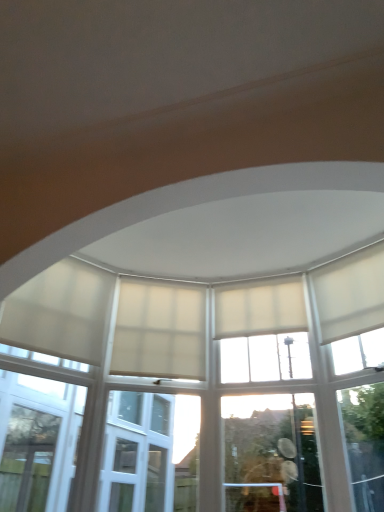
Question: Considering the relative sizes of beige fabric curtain at center, the 3th curtain when ordered from right to left, and white matte curtain at upper right, which appears as the 4th curtain when viewed from the left, in the image provided, is beige fabric curtain at center, the 3th curtain when ordered from right to left, bigger than white matte curtain at upper right, which appears as the 4th curtain when viewed from the left,?

Choices:
 (A) no
 (B) yes

Answer: (A)

Question: Can you confirm if beige fabric curtain at center, the second curtain viewed from the left, is thinner than white matte curtain at upper right, which appears as the 4th curtain when viewed from the left?

Choices:
 (A) no
 (B) yes

Answer: (B)

Question: From the image's perspective, is beige fabric curtain at center, the 3th curtain when ordered from right to left, under white matte curtain at upper right, which appears as the 4th curtain when viewed from the left?

Choices:
 (A) no
 (B) yes

Answer: (B)

Question: Is beige fabric curtain at center, the 3th curtain when ordered from right to left, in front of white matte curtain at upper right, placed as the 1th curtain when sorted from right to left?

Choices:
 (A) yes
 (B) no

Answer: (B)

Question: Is beige fabric curtain at center, the 3th curtain when ordered from right to left, to the left of white matte curtain at upper right, placed as the 1th curtain when sorted from right to left, from the viewer's perspective?

Choices:
 (A) yes
 (B) no

Answer: (A)

Question: From their relative heights in the image, would you say white matte curtain at upper right, placed as the 1th curtain when sorted from right to left, is taller or shorter than beige fabric curtain at center, the second curtain viewed from the left?

Choices:
 (A) tall
 (B) short

Answer: (B)

Question: From the image's perspective, is white matte curtain at upper right, placed as the 1th curtain when sorted from right to left, located above or below beige fabric curtain at center, the second curtain viewed from the left?

Choices:
 (A) below
 (B) above

Answer: (B)

Question: Based on their positions, is white matte curtain at upper right, which appears as the 4th curtain when viewed from the left, located to the left or right of beige fabric curtain at center, the second curtain viewed from the left?

Choices:
 (A) right
 (B) left

Answer: (A)

Question: From a real-world perspective, relative to beige fabric curtain at center, the second curtain viewed from the left, is white matte curtain at upper right, placed as the 1th curtain when sorted from right to left, vertically above or below?

Choices:
 (A) below
 (B) above

Answer: (B)

Question: In terms of width, does white matte curtain at left, the first curtain viewed from the left, look wider or thinner when compared to beige fabric curtain at center, the second curtain viewed from the left?

Choices:
 (A) thin
 (B) wide

Answer: (B)

Question: From a real-world perspective, is white matte curtain at left, the fourth curtain positioned from the right, positioned above or below beige fabric curtain at center, the 3th curtain when ordered from right to left?

Choices:
 (A) above
 (B) below

Answer: (A)

Question: Considering their positions, is white matte curtain at left, the fourth curtain positioned from the right, located in front of or behind beige fabric curtain at center, the 3th curtain when ordered from right to left?

Choices:
 (A) front
 (B) behind

Answer: (A)

Question: From their relative heights in the image, would you say white matte curtain at left, the first curtain viewed from the left, is taller or shorter than beige fabric curtain at center, the second curtain viewed from the left?

Choices:
 (A) short
 (B) tall

Answer: (B)

Question: Does point (226, 328) appear closer or farther from the camera than point (3, 330)?

Choices:
 (A) closer
 (B) farther

Answer: (B)

Question: Based on their positions, is white matte curtain at center, which ranks as the third curtain in left-to-right order, located to the left or right of white matte curtain at left, the first curtain viewed from the left?

Choices:
 (A) left
 (B) right

Answer: (B)